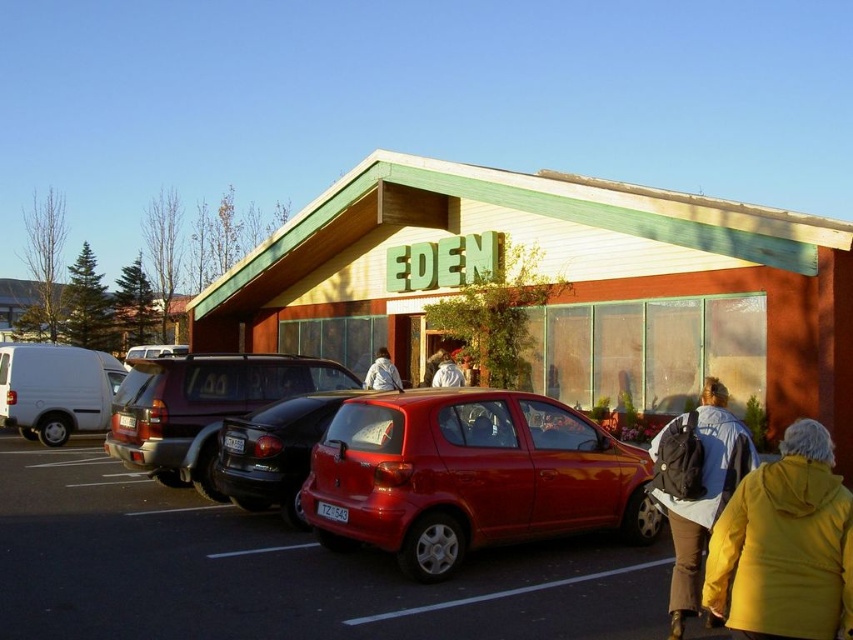
You are a delivery person approaching the EDEN building and need to park your vehicle. You see a white matte van at left and a black rubber tire at lower center. Which object is closer to you as you approach the building?

The white matte van at left is closer to you because it is further to the viewer than the black rubber tire at lower center, meaning it is positioned nearer in the scene.

From the picture: You are standing at the entrance of EDEN and want to locate both the yellow matte jacket at lower right and the matte black suv at center. Which object is positioned more to the right side of the scene?

The yellow matte jacket at lower right is positioned more to the right side of the scene compared to the matte black suv at center.